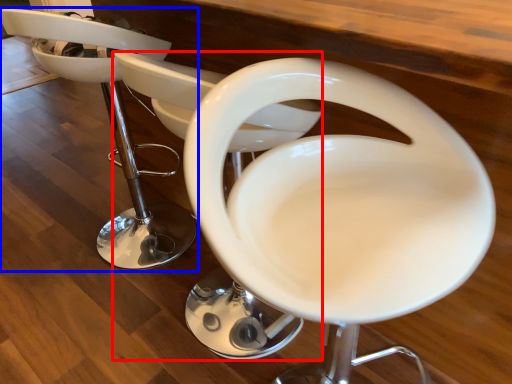
Question: Among these objects, which one is nearest to the camera, feeding chair (highlighted by a red box) or chair (highlighted by a blue box)?

Choices:
 (A) feeding chair
 (B) chair

Answer: (A)